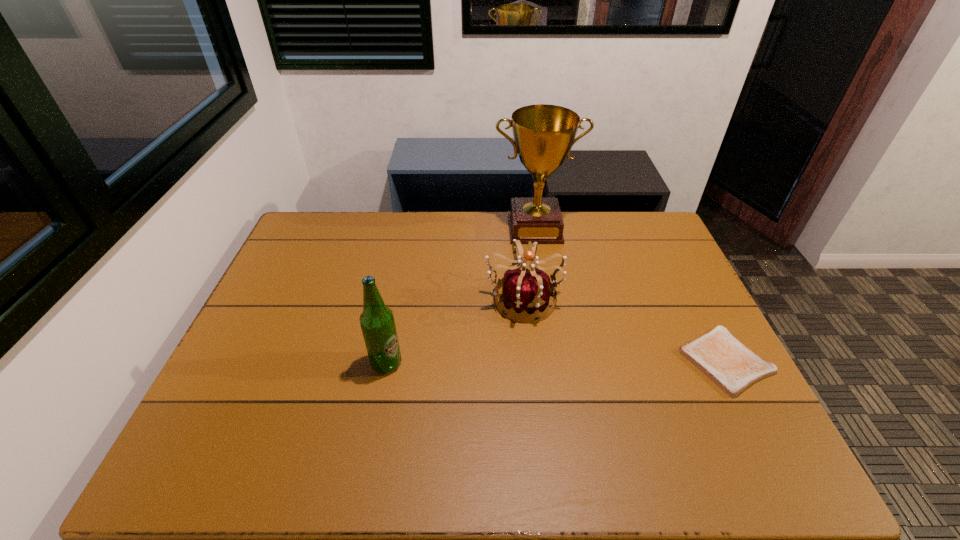
In order to click on beer bottle in this screenshot , I will do `click(377, 322)`.

Where is `the third shortest object`? The height and width of the screenshot is (540, 960). the third shortest object is located at coordinates (377, 322).

The height and width of the screenshot is (540, 960). I want to click on the shortest object, so click(x=728, y=363).

Locate an element on the screen. This screenshot has width=960, height=540. toast is located at coordinates (728, 363).

Locate an element on the screen. The width and height of the screenshot is (960, 540). the farthest object is located at coordinates (544, 134).

The height and width of the screenshot is (540, 960). In order to click on award in this screenshot , I will do `click(544, 134)`.

This screenshot has width=960, height=540. In order to click on tiara in this screenshot , I will do coord(524,290).

This screenshot has height=540, width=960. Identify the location of the second farthest object. (524, 290).

At what (x,y) coordinates should I click in order to perform the action: click on vacant space located 0.310m on the label of the leftmost object. Please return your answer as a coordinate pair (x, y). The width and height of the screenshot is (960, 540). Looking at the image, I should click on click(x=521, y=363).

The width and height of the screenshot is (960, 540). In order to click on vacant space located on the left of the rightmost object in this screenshot , I will do `click(564, 361)`.